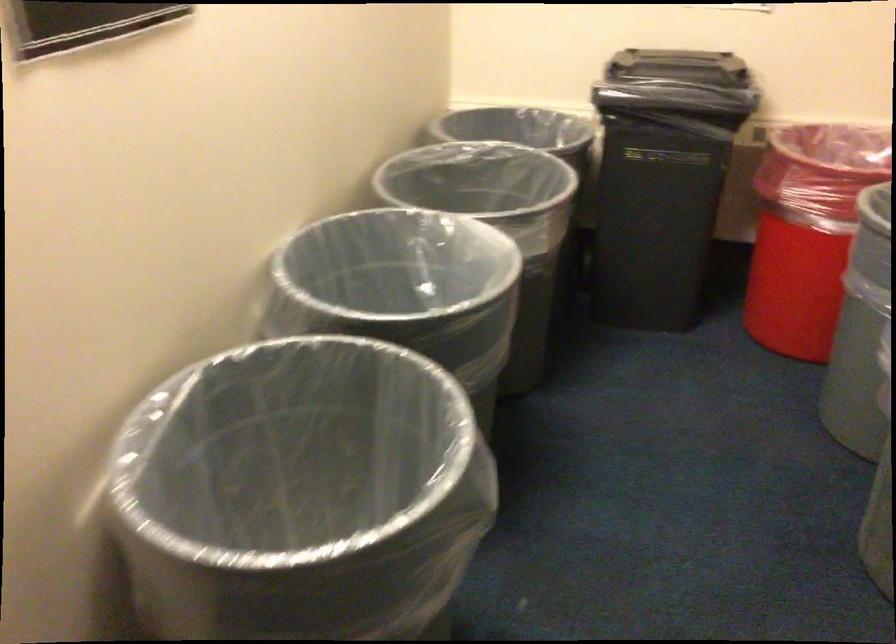
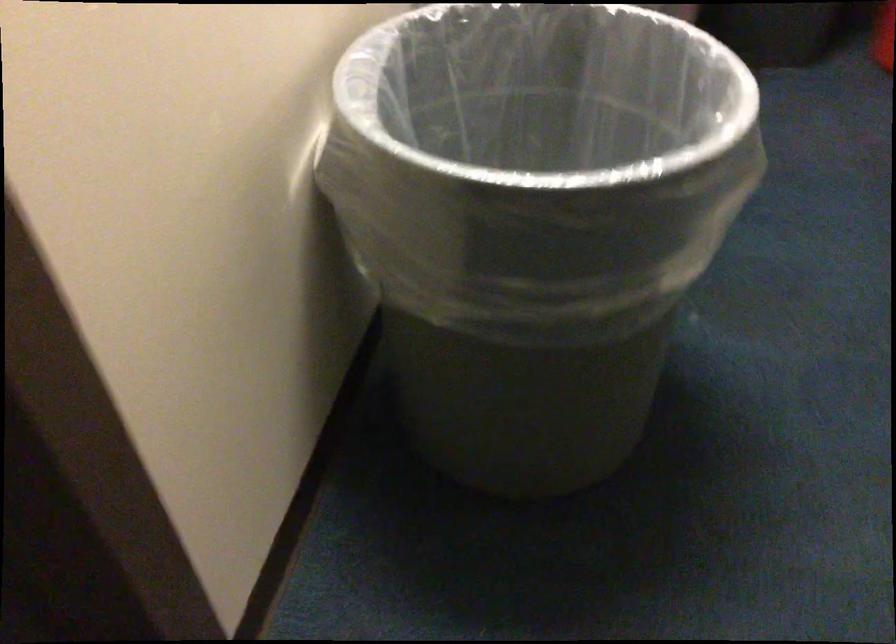
In the second image, find the point that corresponds to (x=359, y=438) in the first image.

(538, 136)